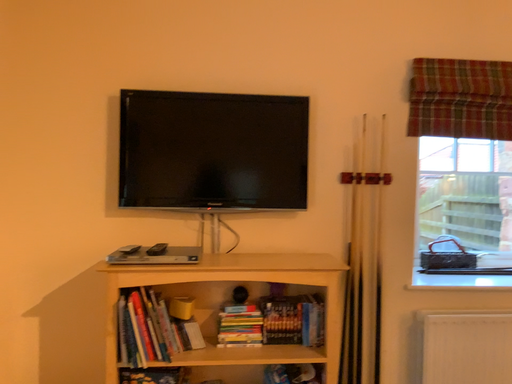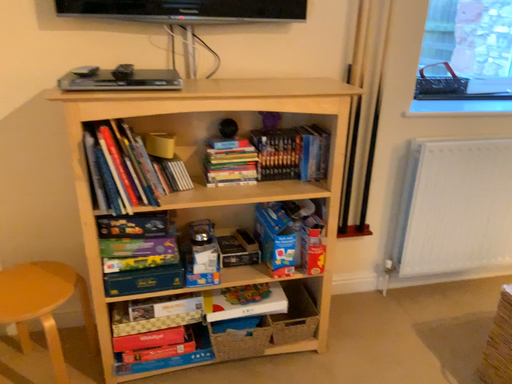
Question: How did the camera likely rotate when shooting the video?

Choices:
 (A) rotated upward
 (B) rotated downward

Answer: (B)